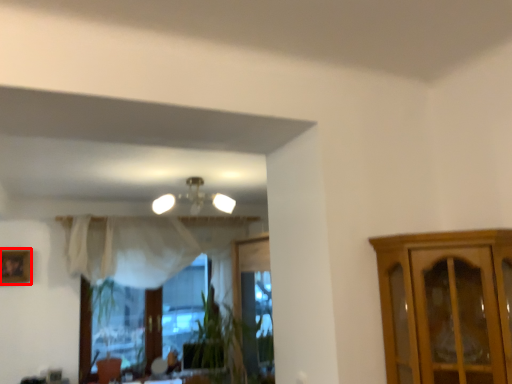
Question: From the image's perspective, where is picture frame (annotated by the red box) located relative to lamp?

Choices:
 (A) above
 (B) below

Answer: (B)